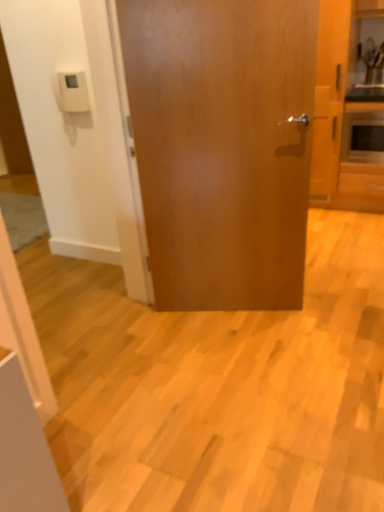
The width and height of the screenshot is (384, 512). Identify the location of matte silver microwave at right. (363, 137).

What do you see at coordinates (363, 137) in the screenshot? Image resolution: width=384 pixels, height=512 pixels. I see `matte silver microwave at right` at bounding box center [363, 137].

Where is `wooden cabinet at right`? This screenshot has width=384, height=512. wooden cabinet at right is located at coordinates (348, 109).

What are the coordinates of `matte silver microwave at right` in the screenshot? It's located at (363, 137).

This screenshot has width=384, height=512. I want to click on cabinetry above the glossy wood door at center (from a real-world perspective), so click(x=348, y=109).

From the image's perspective, is wooden cabinet at right beneath glossy wood door at center?

No.

From the picture: Is wooden cabinet at right to the left of glossy wood door at center from the viewer's perspective?

No, wooden cabinet at right is not to the left of glossy wood door at center.

Is glossy wood door at center not within matte silver microwave at right?

Yes.

Is glossy wood door at center looking in the opposite direction of matte silver microwave at right?

No.

Which object is further away from the camera, glossy wood door at center or matte silver microwave at right?

Positioned behind is matte silver microwave at right.

Considering the relative sizes of glossy wood door at center and matte silver microwave at right in the image provided, is glossy wood door at center shorter than matte silver microwave at right?

No.

Looking at this image, between wooden cabinet at right and matte silver microwave at right, which one has larger size?

wooden cabinet at right is bigger.

From a real-world perspective, is wooden cabinet at right below matte silver microwave at right?

No.

Would you say matte silver microwave at right is part of wooden cabinet at right's contents?

No, wooden cabinet at right does not contain matte silver microwave at right.

How much distance is there between glossy wood door at center and wooden cabinet at right?

The distance of glossy wood door at center from wooden cabinet at right is 1.55 meters.

In the scene shown: From the image's perspective, which is below, glossy wood door at center or wooden cabinet at right?

glossy wood door at center is shown below in the image.

Can you tell me how much glossy wood door at center and wooden cabinet at right differ in facing direction?

They differ by 20.7 degrees in their facing directions.

Does glossy wood door at center have a greater height compared to wooden cabinet at right?

In fact, glossy wood door at center may be shorter than wooden cabinet at right.

Looking at this image, from a real-world perspective, between matte silver microwave at right and wooden cabinet at right, who is vertically higher?

wooden cabinet at right.

Based on the photo, is matte silver microwave at right located outside wooden cabinet at right?

Yes.

From the picture: Considering the relative sizes of matte silver microwave at right and wooden cabinet at right in the image provided, is matte silver microwave at right thinner than wooden cabinet at right?

Correct, the width of matte silver microwave at right is less than that of wooden cabinet at right.

Based on the photo, can you confirm if matte silver microwave at right is positioned to the right of wooden cabinet at right?

Correct, you'll find matte silver microwave at right to the right of wooden cabinet at right.

How different are the orientations of matte silver microwave at right and glossy wood door at center in degrees?

The angular difference between matte silver microwave at right and glossy wood door at center is 20.5 degrees.

From a real-world perspective, does matte silver microwave at right stand above glossy wood door at center?

No, from a real-world perspective, matte silver microwave at right is not over glossy wood door at center

Is glossy wood door at center at the back of matte silver microwave at right?

matte silver microwave at right is not turned away from glossy wood door at center.

Is matte silver microwave at right taller than glossy wood door at center?

Incorrect, the height of matte silver microwave at right is not larger of that of glossy wood door at center.

Locate an element on the screen. cabinetry behind the glossy wood door at center is located at coordinates (348, 109).

Where is `appliance on the right of glossy wood door at center`? appliance on the right of glossy wood door at center is located at coordinates (363, 137).

Looking at the image, which one is located closer to wooden cabinet at right, glossy wood door at center or matte silver microwave at right?

matte silver microwave at right lies closer to wooden cabinet at right than the other object.

Based on their spatial positions, is wooden cabinet at right or glossy wood door at center closer to matte silver microwave at right?

Based on the image, wooden cabinet at right appears to be nearer to matte silver microwave at right.

Considering their positions, is matte silver microwave at right positioned further to wooden cabinet at right than glossy wood door at center?

glossy wood door at center lies further to wooden cabinet at right than the other object.

When comparing their distances from glossy wood door at center, does matte silver microwave at right or wooden cabinet at right seem closer?

wooden cabinet at right is positioned closer to the anchor glossy wood door at center.

Estimate the real-world distances between objects in this image. Which object is closer to glossy wood door at center, wooden cabinet at right or matte silver microwave at right?

wooden cabinet at right lies closer to glossy wood door at center than the other object.

Which object lies further to the anchor point matte silver microwave at right, glossy wood door at center or wooden cabinet at right?

Based on the image, glossy wood door at center appears to be further to matte silver microwave at right.

Find the location of a particular element. Image resolution: width=384 pixels, height=512 pixels. cabinetry located between glossy wood door at center and matte silver microwave at right in the depth direction is located at coordinates (348, 109).